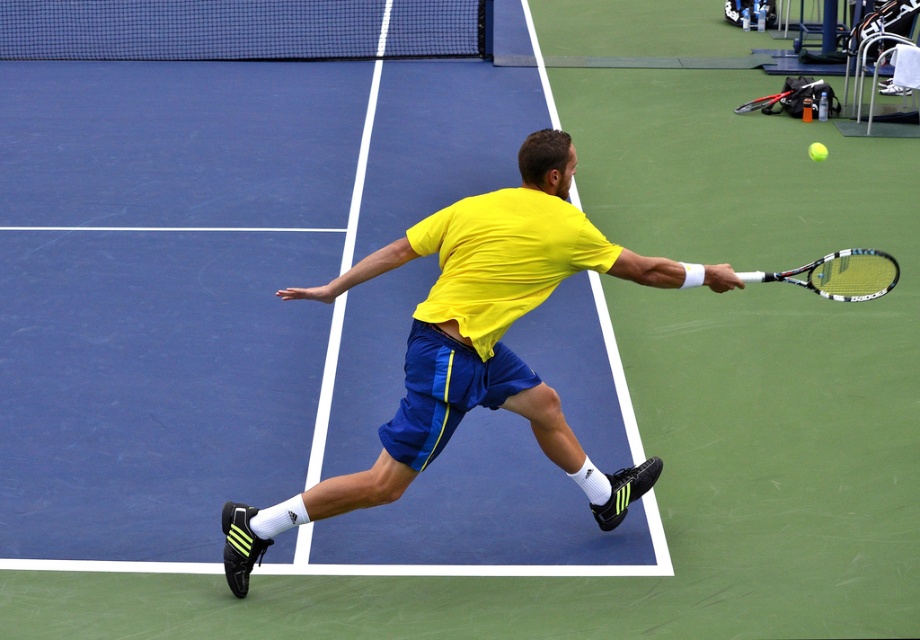
You are a tennis coach analyzing a player photo. The player is wearing a bright yellow T shirt and blue shorts with yellow stripes. The tennis ball is in the air near the top right corner. The player is lunging forward with their right arm extended. Where on the player is the point at coordinates (476, 344) located?

The point at coordinates (476, 344) is located on the yellow matte shirt at center.

You are a tennis coach observing a player attempting to hit the green rubber tennis ball at upper right with their white matte tennis racket at center. Based on their current position, will the racket reach the ball in time?

The white matte tennis racket at center is in front of the green rubber tennis ball at upper right, which means it is closer to the viewer and thus likely positioned to make contact. The racket should reach the ball in time.